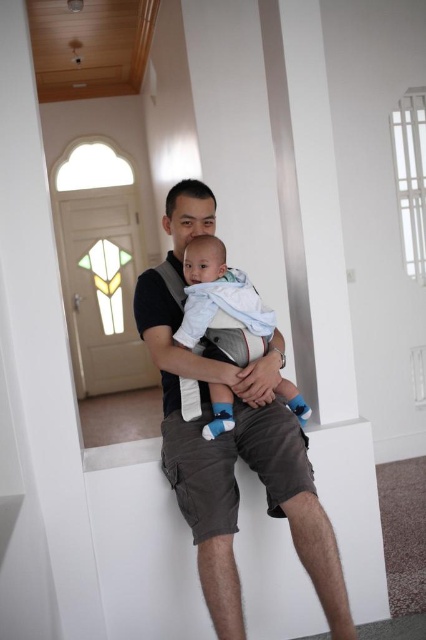
You are a photographer setting up for a family photo. You need to ensure the dark gray cotton shirt at center and the light blue fabric baby at center are both visible in the frame. Based on their positions, which one should you focus on first to make sure the baby is in focus?

The light blue fabric baby at center should be focused on first because the dark gray cotton shirt at center is below it, so focusing on the baby ensures both are in frame and the baby is clear.

You are a photographer trying to capture a candid shot of the man and baby in the scene. You want to ensure the focus is on the man and baby, not the background. Given the point at coordinates point (233, 465) is on dark gray cotton shirt at center, where should you aim your camera to keep the background blurred?

To keep the background blurred while focusing on the man and baby, aim your camera at the point (233, 465) on the dark gray cotton shirt at center. This ensures the focus remains on the subject while the background becomes out of focus.

In the scene shown: You are a photographer setting up a photo shoot in the room. You need to ensure that both the dark gray cotton shirt at center and the light blue fabric baby at center are clearly visible in the frame. Given their sizes, which object should you focus on first to ensure proper exposure?

The dark gray cotton shirt at center is bigger than the light blue fabric baby at center, so you should focus on the dark gray cotton shirt at center first to ensure proper exposure, as larger objects may require more precise focus to capture details.